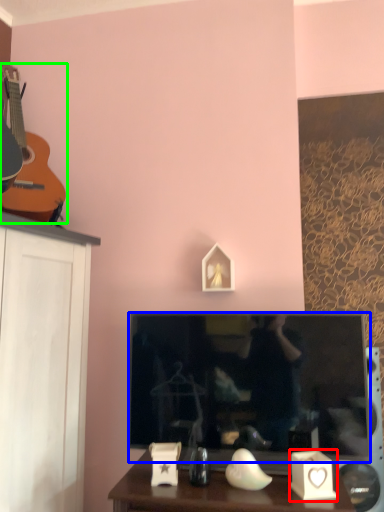
Question: Which is farther away from candle holder (highlighted by a red box)? television (highlighted by a blue box) or guitar (highlighted by a green box)?

Choices:
 (A) television
 (B) guitar

Answer: (B)